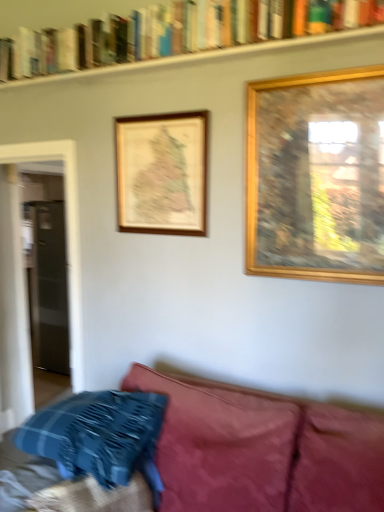
Find the location of a particular element. The image size is (384, 512). vacant space situated above gold wooden picture frame at upper right, the 2th picture frame from the left (from a real-world perspective) is located at coordinates (324, 68).